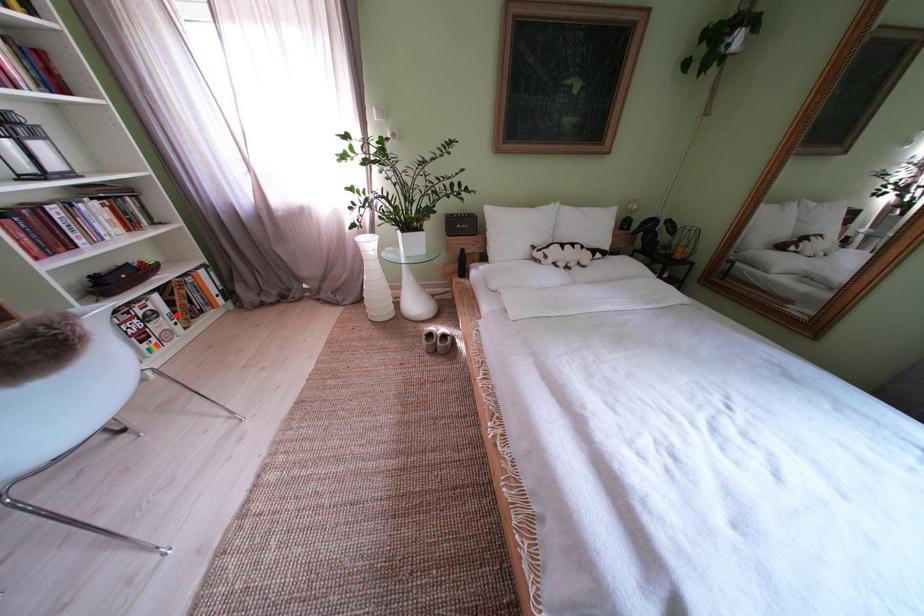
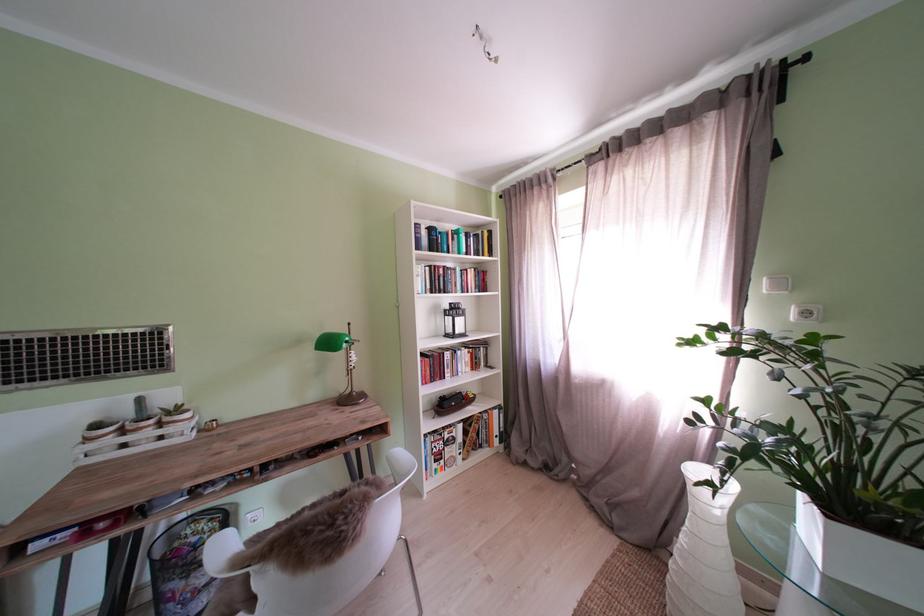
Find the pixel in the second image that matches the highlighted location in the first image.

(470, 444)